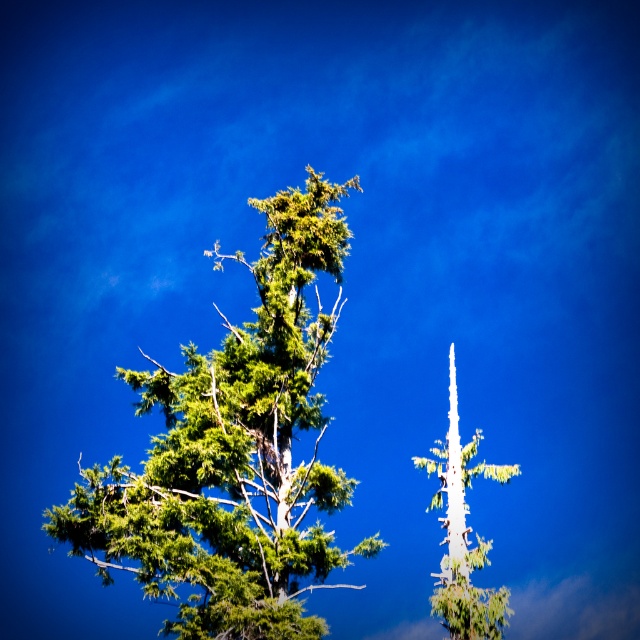
You are standing at the center of the image. Which direction should you move to reach the green textured tree at center?

The green textured tree at center is located at coordinates point (x=234, y=451), so you should move towards the right and slightly upwards from the center to reach it.

In the scene shown: You are standing in front of the two trees and want to place a birdhouse between the two points, point [260,454] and point [461,552]. Since you want the birdhouse to be visible from the front, which point should you place it closer to?

You should place the birdhouse closer to point [461,552] because point [260,454] is behind point [461,552], so placing it closer to the front point will ensure better visibility.

Based on the photo, you are standing at the point with coordinates (234, 451) in the image. Which tree are you facing? The scene has two trees, one is a green textured tree at center and the other is a bare white trunk tree on the right. Please answer based on their positions.

The green textured tree at center is located at point (234, 451), so you are facing the green textured tree at center.